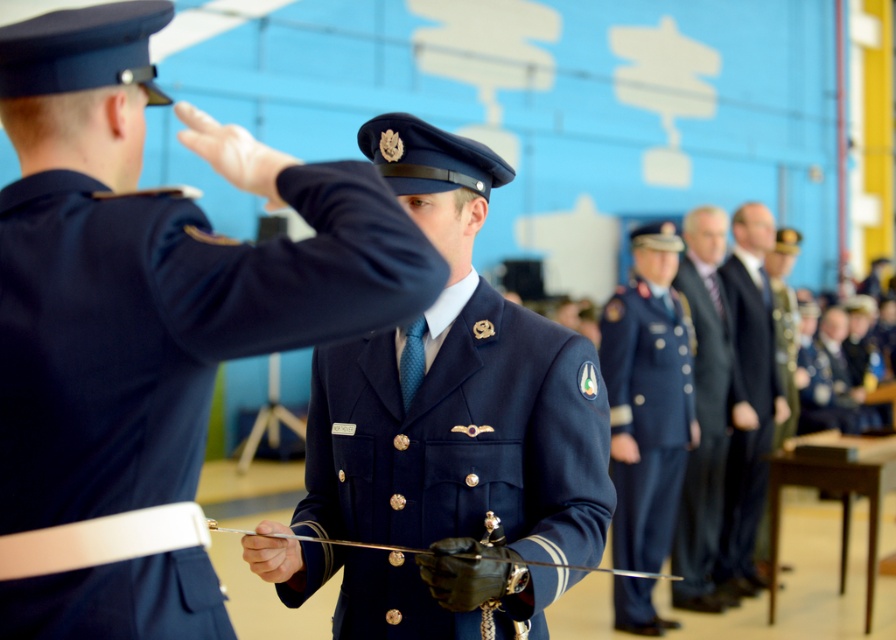
You are a photographer positioned at the center of the hall. You want to take a photo of the navy blue uniform at center. Where should you aim your camera to capture the subject accurately?

The navy blue uniform at center is located at the 2D coordinates point (153,273), so you should aim your camera at that specific point to capture the subject accurately.

You are a photographer positioned at the center of the hall. You want to take a photo of the navy blue uniform at center. According to the coordinates provided, where should you aim your camera to capture the subject accurately?

The navy blue uniform at center is located at coordinates point (x=153, y=273), so you should aim your camera at that exact point to capture the subject accurately.

You are a photographer positioned at the back of the hall. You want to take a photo of both the navy blue uniform at center and the blue fabric uniform at center in the same frame. Given that your camera has a maximum focus range of 6 meters, will you be able to capture both subjects clearly?

The navy blue uniform at center and blue fabric uniform at center are 6.71 meters apart from each other. Since the distance between them exceeds the camera focus range of 6 meters, you won